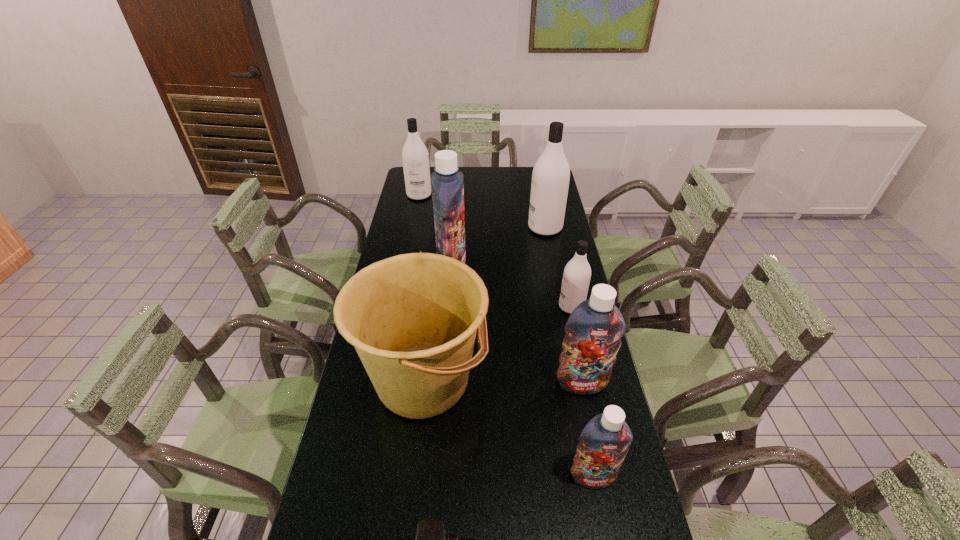
Find the location of a particular element. The height and width of the screenshot is (540, 960). vacant area that lies between the farthest blue shampoo and the fifth farthest shampoo is located at coordinates (516, 324).

Where is `vacant point located between the farthest white shampoo and the second smallest blue shampoo`? vacant point located between the farthest white shampoo and the second smallest blue shampoo is located at coordinates [500, 289].

This screenshot has height=540, width=960. Identify the location of free area in between the leftmost blue shampoo and the nearest white shampoo. (512, 286).

Identify which object is the nearest to the nearest blue shampoo. Please provide its 2D coordinates. Your answer should be formatted as a tuple, i.e. [(x, y)], where the tuple contains the x and y coordinates of a point satisfying the conditions above.

[(594, 329)]

Choose which object is the third nearest neighbor to the second biggest blue shampoo. Please provide its 2D coordinates. Your answer should be formatted as a tuple, i.e. [(x, y)], where the tuple contains the x and y coordinates of a point satisfying the conditions above.

[(576, 278)]

Where is `shampoo that is the fourth closest to the fifth nearest shampoo`? This screenshot has height=540, width=960. shampoo that is the fourth closest to the fifth nearest shampoo is located at coordinates (594, 329).

Identify the location of shampoo that stands as the second closest to the second nearest white shampoo. This screenshot has height=540, width=960. (576, 278).

Point out which white shampoo is positioned as the nearest to the smallest blue shampoo. Please provide its 2D coordinates. Your answer should be formatted as a tuple, i.e. [(x, y)], where the tuple contains the x and y coordinates of a point satisfying the conditions above.

[(576, 278)]

You are a GUI agent. You are given a task and a screenshot of the screen. Output one action in this format:
    pyautogui.click(x=<x>, y=<y>)
    Task: Click on the closest white shampoo to the second biggest blue shampoo
    
    Given the screenshot: What is the action you would take?
    pyautogui.click(x=576, y=278)

The image size is (960, 540). Find the location of `blue shampoo that can be found as the closest to the smallest white shampoo`. blue shampoo that can be found as the closest to the smallest white shampoo is located at coordinates (594, 329).